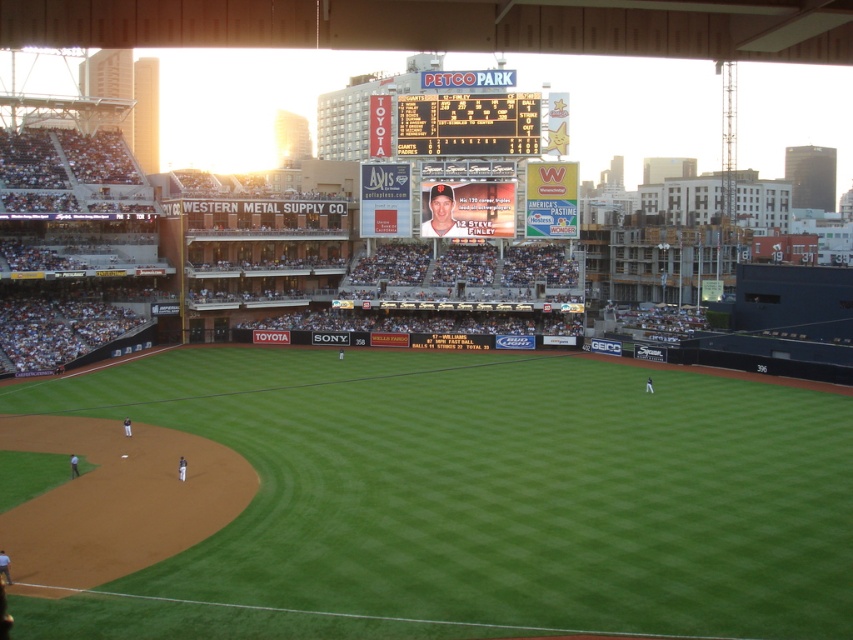
Question: Which object is the closest to the green artificial turf at center?

Choices:
 (A) black plastic scoreboard at upper center
 (B) matte plastic baseball card at center

Answer: (A)

Question: Among these points, which one is farthest from the camera?

Choices:
 (A) (577, 602)
 (B) (434, 150)

Answer: (B)

Question: Is the position of green artificial turf at center more distant than that of black plastic scoreboard at upper center?

Choices:
 (A) no
 (B) yes

Answer: (A)

Question: Does black plastic scoreboard at upper center appear on the left side of matte plastic baseball card at center?

Choices:
 (A) no
 (B) yes

Answer: (A)

Question: From the image, what is the correct spatial relationship of green artificial turf at center in relation to black plastic scoreboard at upper center?

Choices:
 (A) right
 (B) left

Answer: (B)

Question: Which object is the farthest from the matte plastic baseball card at center?

Choices:
 (A) black plastic scoreboard at upper center
 (B) green artificial turf at center

Answer: (B)